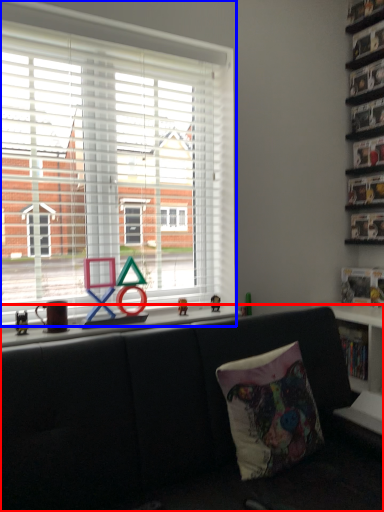
Question: Which point is further to the camera, studio couch (highlighted by a red box) or window (highlighted by a blue box)?

Choices:
 (A) studio couch
 (B) window

Answer: (B)